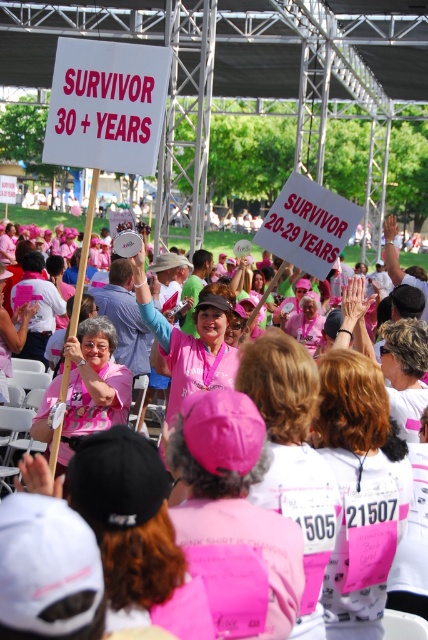
Question: Observing the image, what is the correct spatial positioning of white matte shirt at center in reference to pink fabric sign at center?

Choices:
 (A) above
 (B) below

Answer: (B)

Question: Is pink fabric crowd at center thinner than pink fabric sign at center?

Choices:
 (A) no
 (B) yes

Answer: (A)

Question: Which is farther from the pink fabric shirt at center?

Choices:
 (A) pink fabric crowd at center
 (B) pink satin scarf at center
 (C) white matte shirt at center

Answer: (B)

Question: Which object is the closest to the pink fabric sign at center?

Choices:
 (A) pink fabric crowd at center
 (B) pink satin scarf at center
 (C) pink fabric shirt at center

Answer: (C)

Question: In this image, where is white matte shirt at center located relative to pink fabric crowd at center?

Choices:
 (A) left
 (B) right

Answer: (B)

Question: Which point appears closest to the camera in this image?

Choices:
 (A) (287, 323)
 (B) (165, 282)
 (C) (58, 381)
 (D) (267, 496)

Answer: (D)